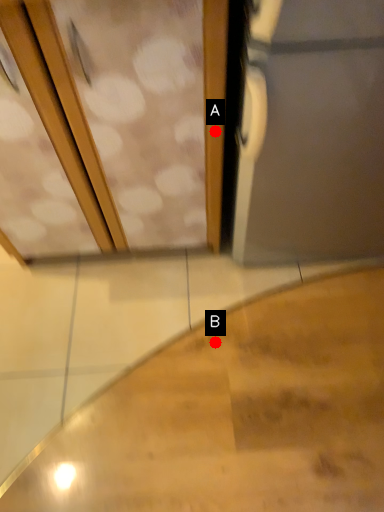
Question: Two points are circled on the image, labeled by A and B beside each circle. Among these points, which one is farthest from the camera?

Choices:
 (A) A is further
 (B) B is further

Answer: (B)